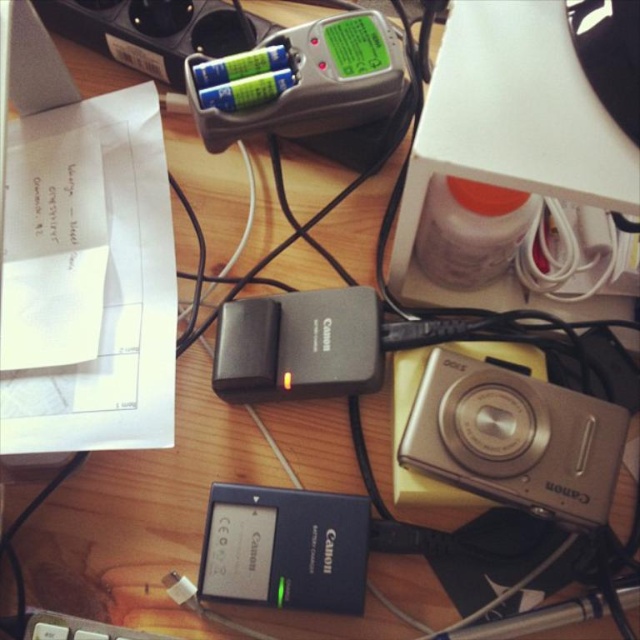
You are organizing the desk and want to place the silver metallic camera at lower right and the silver plastic battery charger at upper center in a way that they don not overlap. Based on their current positions, which object should you move upwards to achieve this?

The silver metallic camera at lower right is below the silver plastic battery charger at upper center. To prevent overlapping, you should move the silver metallic camera at lower right upwards.

You are looking at the cluttered desk workspace. There are two points marked on the desk surface, one at point (538,476) and the other at point (365,109). From your perspective, which point is closer to you?

Point (538,476) is in front of point (365,109), so it is closer to you.